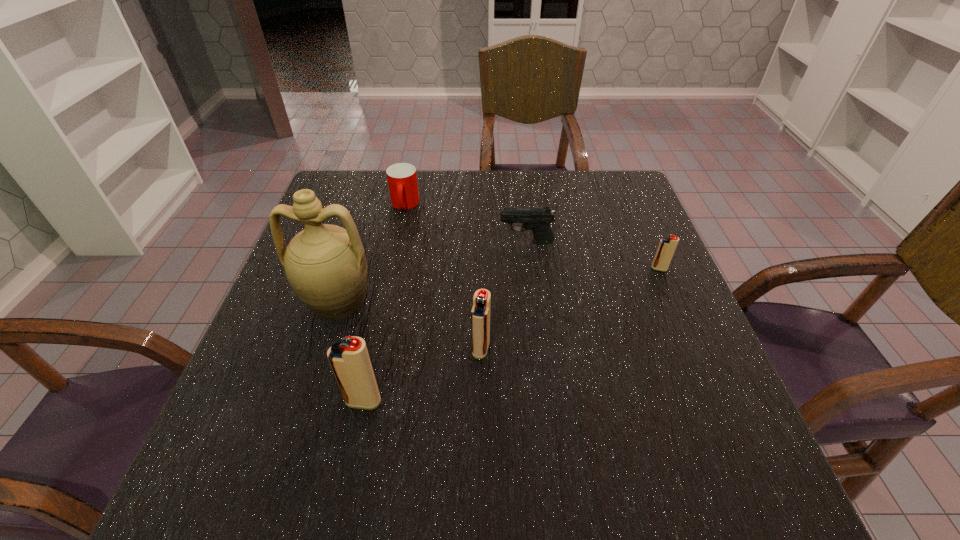
The height and width of the screenshot is (540, 960). In order to click on object that is at the near edge in this screenshot , I will do `click(350, 361)`.

Where is `object that is at the left edge`? The image size is (960, 540). object that is at the left edge is located at coordinates point(325,265).

Image resolution: width=960 pixels, height=540 pixels. I want to click on object at the right edge, so click(x=667, y=246).

Locate an element on the screen. This screenshot has width=960, height=540. free space at the far edge is located at coordinates [x=506, y=202].

Where is `free space at the near edge of the desktop`? free space at the near edge of the desktop is located at coordinates (396, 421).

You are a GUI agent. You are given a task and a screenshot of the screen. Output one action in this format:
    pyautogui.click(x=<x>, y=<y>)
    Task: Click on the free space at the left edge
    This screenshot has height=540, width=960.
    Given the screenshot: What is the action you would take?
    pyautogui.click(x=263, y=371)

This screenshot has width=960, height=540. Identify the location of vacant area at the right edge. (664, 333).

In the image, there is a desktop. At what (x,y) coordinates should I click in order to perform the action: click on vacant space at the near left corner. Please return your answer as a coordinate pair (x, y). This screenshot has width=960, height=540. Looking at the image, I should click on (231, 402).

This screenshot has height=540, width=960. I want to click on vacant space at the far right corner of the desktop, so click(x=610, y=171).

Where is `free space at the near right corner of the desktop`? The image size is (960, 540). free space at the near right corner of the desktop is located at coordinates (698, 417).